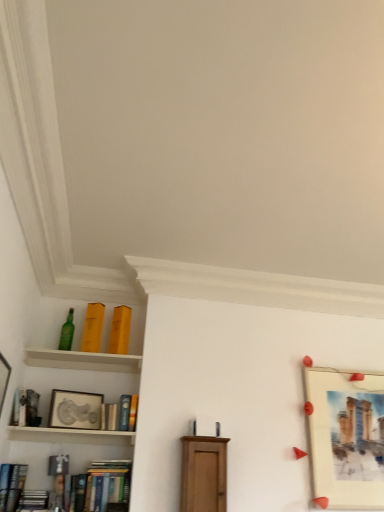
This screenshot has width=384, height=512. Identify the location of free space to the left of green glass bottle at upper left. (41, 356).